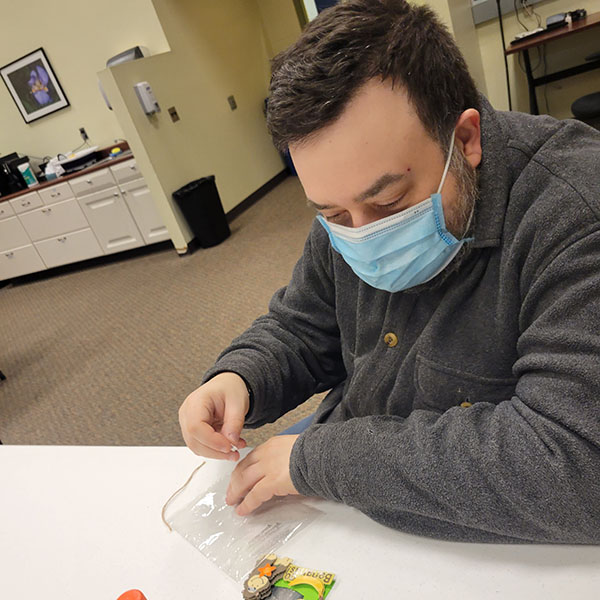
The image size is (600, 600). I want to click on table, so click(x=387, y=556).